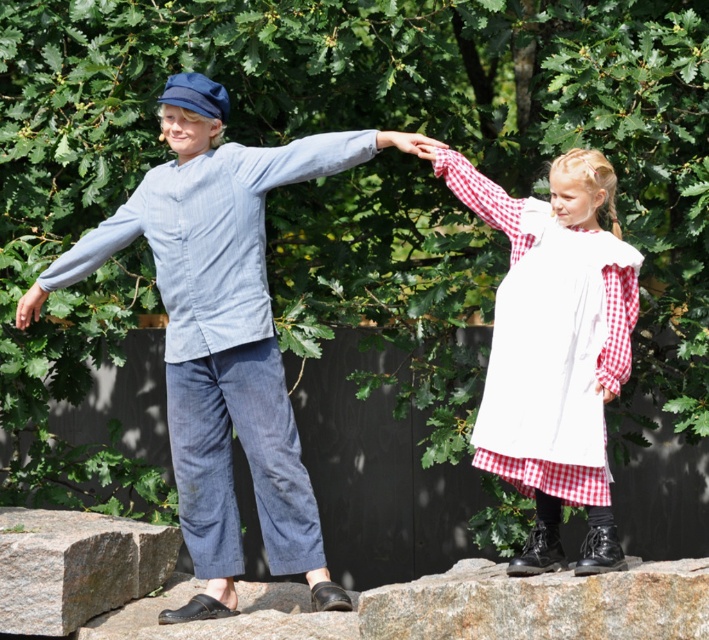
You are trying to determine if the granite boulder at lower center can fit through a doorway that is the same width as the denim shirt sleeve at upper center. Based on their sizes, will the boulder fit?

The granite boulder at lower center might be wider than the denim shirt sleeve at upper center, so it likely cannot fit through the doorway.

You are a photographer setting up a tripod to capture the children in the scene. The granite boulder at lower left and the light blue denim pants at left are in your view. Which object should you position closer to the camera to ensure it takes up more space in the photo?

The granite boulder at lower left might be wider than light blue denim pants at left, so positioning the granite boulder at lower left closer to the camera would make it appear larger in the photo.